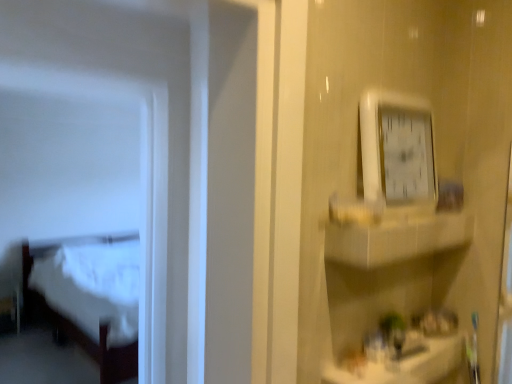
Question: Can you confirm if white glossy counter top at lower right is smaller than white plastic clock at upper right?

Choices:
 (A) yes
 (B) no

Answer: (B)

Question: Can you confirm if white glossy counter top at lower right is thinner than white plastic clock at upper right?

Choices:
 (A) no
 (B) yes

Answer: (A)

Question: From a real-world perspective, is white glossy counter top at lower right under white plastic clock at upper right?

Choices:
 (A) no
 (B) yes

Answer: (B)

Question: Considering the relative positions of white glossy counter top at lower right and white plastic clock at upper right in the image provided, is white glossy counter top at lower right to the left of white plastic clock at upper right from the viewer's perspective?

Choices:
 (A) no
 (B) yes

Answer: (A)

Question: From the image's perspective, is white glossy counter top at lower right located beneath white plastic clock at upper right?

Choices:
 (A) no
 (B) yes

Answer: (B)

Question: Is white glossy counter top at lower right at the right side of white plastic clock at upper right?

Choices:
 (A) yes
 (B) no

Answer: (A)

Question: Could white plastic clock at upper right be considered to be inside white glossy cabinet at upper right?

Choices:
 (A) yes
 (B) no

Answer: (B)

Question: From the image's perspective, is white glossy cabinet at upper right under white plastic clock at upper right?

Choices:
 (A) yes
 (B) no

Answer: (A)

Question: From a real-world perspective, is white glossy cabinet at upper right over white plastic clock at upper right?

Choices:
 (A) no
 (B) yes

Answer: (A)

Question: Considering the relative sizes of white glossy cabinet at upper right and white plastic clock at upper right in the image provided, is white glossy cabinet at upper right taller than white plastic clock at upper right?

Choices:
 (A) no
 (B) yes

Answer: (A)

Question: Considering the relative positions of white glossy cabinet at upper right and white plastic clock at upper right in the image provided, is white glossy cabinet at upper right to the right of white plastic clock at upper right from the viewer's perspective?

Choices:
 (A) yes
 (B) no

Answer: (A)

Question: Considering the relative sizes of white glossy cabinet at upper right and white plastic clock at upper right in the image provided, is white glossy cabinet at upper right wider than white plastic clock at upper right?

Choices:
 (A) yes
 (B) no

Answer: (A)

Question: Can you confirm if white wood bed at left is smaller than white glossy counter top at lower right?

Choices:
 (A) yes
 (B) no

Answer: (B)